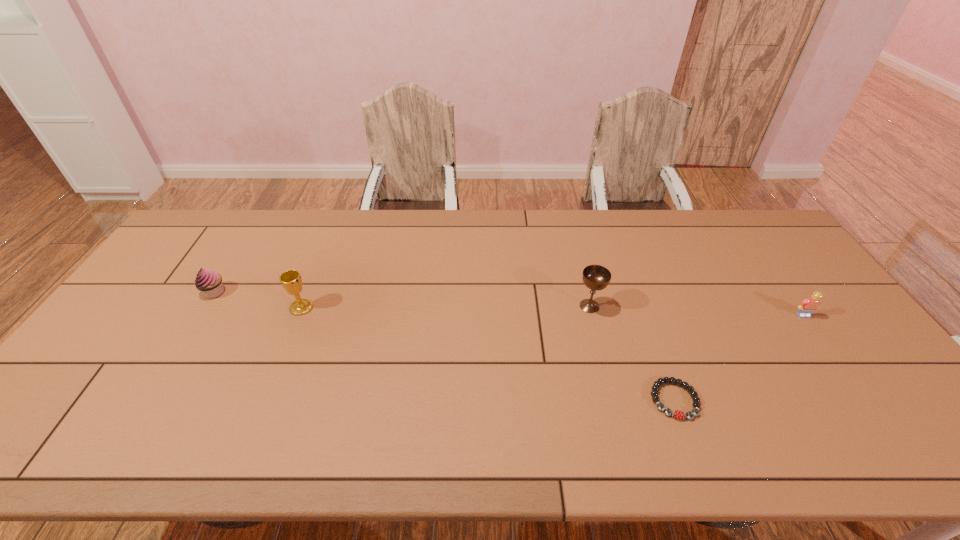
This screenshot has height=540, width=960. Identify the location of the third object from right to left. (595, 277).

The image size is (960, 540). I want to click on the fourth object from right to left, so click(291, 280).

You are a GUI agent. You are given a task and a screenshot of the screen. Output one action in this format:
    pyautogui.click(x=<x>, y=<y>)
    Task: Click on the cupcake
    The width and height of the screenshot is (960, 540).
    Given the screenshot: What is the action you would take?
    pyautogui.click(x=209, y=282)

Where is `the rightmost object`? This screenshot has width=960, height=540. the rightmost object is located at coordinates (809, 305).

Find the location of a particular element. the shortest object is located at coordinates (677, 414).

Identify the location of the fourth object from left to right. This screenshot has height=540, width=960. (677, 414).

Locate an element on the screen. The width and height of the screenshot is (960, 540). free space located on the right of the right chalice is located at coordinates (640, 306).

Locate an element on the screen. The width and height of the screenshot is (960, 540). free space located on the left of the second object from left to right is located at coordinates (239, 307).

The height and width of the screenshot is (540, 960). I want to click on free spot located on the back of the leftmost object, so (x=254, y=227).

The height and width of the screenshot is (540, 960). What are the coordinates of `vacant space situated 0.120m on the front-facing side of the Lego` in the screenshot? It's located at pyautogui.click(x=829, y=352).